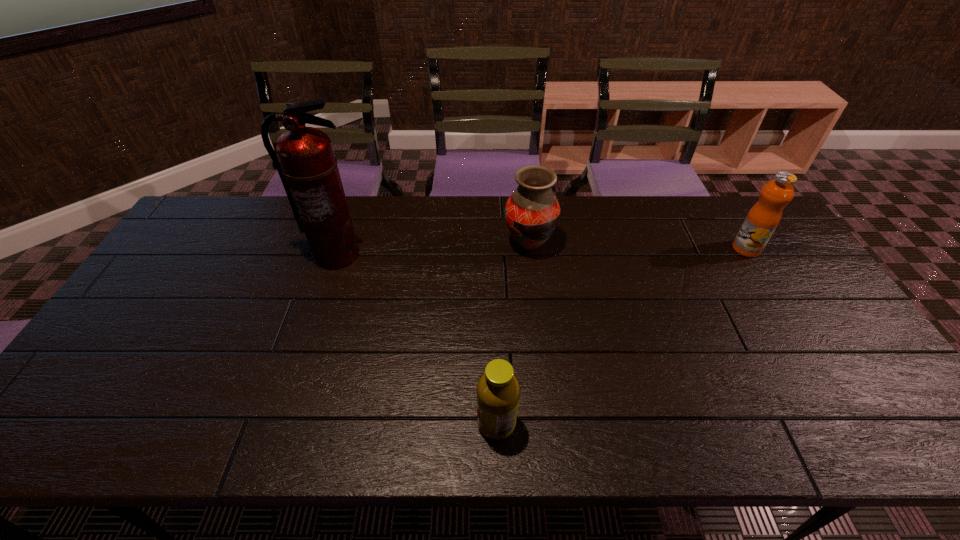
Identify the location of free space between the fire extinguisher and the rightmost object. This screenshot has height=540, width=960. pos(541,252).

Where is `free space that is in between the tallest object and the shorter fruit juice`? free space that is in between the tallest object and the shorter fruit juice is located at coordinates (416, 339).

This screenshot has width=960, height=540. Identify the location of free spot between the leftmost object and the vase. (432, 249).

Locate an element on the screen. object that is the second closest one to the rightmost object is located at coordinates (498, 391).

Locate an element on the screen. The image size is (960, 540). the second closest object relative to the fire extinguisher is located at coordinates (498, 391).

At what (x,y) coordinates should I click in order to perform the action: click on vacant space that satisfies the following two spatial constraints: 1. on the front side of the rightmost object; 2. on the front label of the nearest object. Please return your answer as a coordinate pair (x, y). This screenshot has width=960, height=540. Looking at the image, I should click on (854, 424).